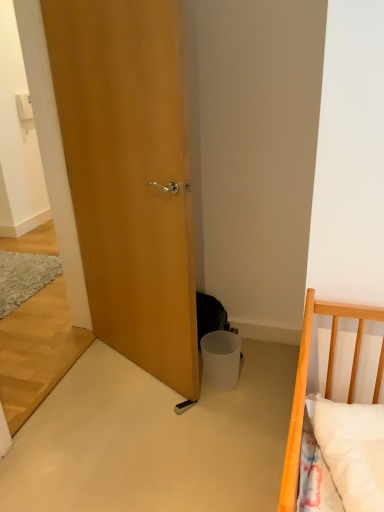
Question: Considering the positions of point (59, 10) and point (203, 373), is point (59, 10) closer or farther from the camera than point (203, 373)?

Choices:
 (A) closer
 (B) farther

Answer: (A)

Question: Looking at their shapes, would you say wooden door at center is wider or thinner than white matte trash bin at lower center?

Choices:
 (A) thin
 (B) wide

Answer: (A)

Question: Is wooden door at center taller or shorter than white matte trash bin at lower center?

Choices:
 (A) tall
 (B) short

Answer: (A)

Question: Considering the positions of white matte trash bin at lower center and wooden door at center in the image, is white matte trash bin at lower center wider or thinner than wooden door at center?

Choices:
 (A) thin
 (B) wide

Answer: (B)

Question: Considering the positions of white matte trash bin at lower center and wooden door at center in the image, is white matte trash bin at lower center taller or shorter than wooden door at center?

Choices:
 (A) short
 (B) tall

Answer: (A)

Question: Would you say white matte trash bin at lower center is to the left or to the right of wooden door at center in the picture?

Choices:
 (A) left
 (B) right

Answer: (B)

Question: From a real-world perspective, is white matte trash bin at lower center positioned above or below wooden door at center?

Choices:
 (A) below
 (B) above

Answer: (A)